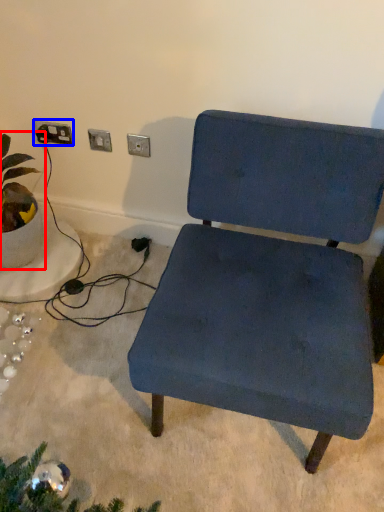
Question: Among these objects, which one is farthest to the camera, houseplant (highlighted by a red box) or electric outlet (highlighted by a blue box)?

Choices:
 (A) houseplant
 (B) electric outlet

Answer: (B)